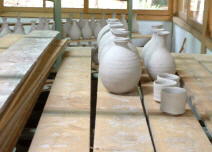
Where is `wall`? This screenshot has width=212, height=152. wall is located at coordinates (192, 46), (141, 25), (25, 20).